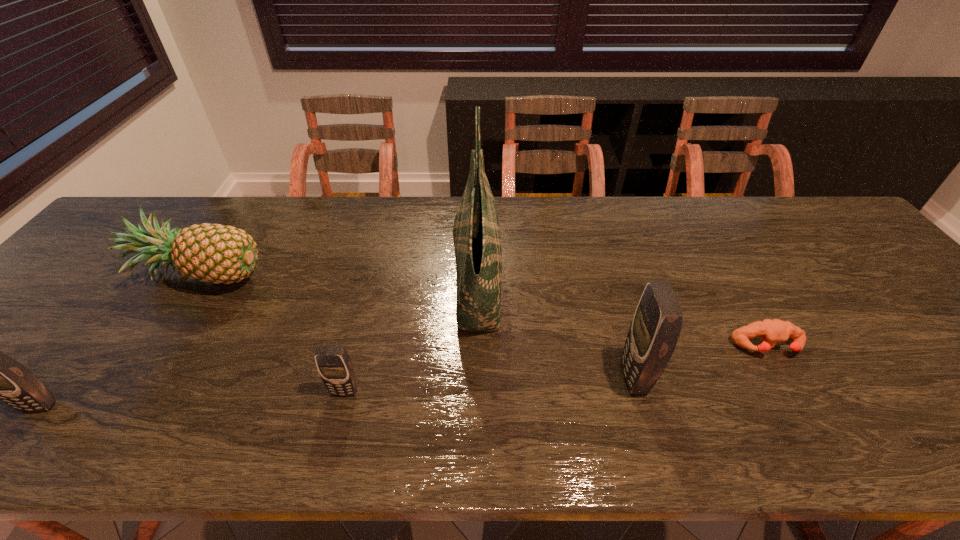
Where is `free spot at the far left corner of the desktop`? This screenshot has height=540, width=960. free spot at the far left corner of the desktop is located at coordinates (192, 196).

The width and height of the screenshot is (960, 540). I want to click on vacant space that's between the tallest object and the second shortest object, so click(411, 336).

This screenshot has width=960, height=540. I want to click on vacant region between the tallest object and the second shortest cellular telephone, so click(x=258, y=343).

Where is `empty space between the shortest object and the second cellular telephone from right to left`? This screenshot has height=540, width=960. empty space between the shortest object and the second cellular telephone from right to left is located at coordinates (556, 369).

Where is `free space that is in between the tote bag and the leftmost cellular telephone`? The image size is (960, 540). free space that is in between the tote bag and the leftmost cellular telephone is located at coordinates (258, 343).

Locate an element on the screen. The width and height of the screenshot is (960, 540). free space between the second object from right to left and the tote bag is located at coordinates (555, 329).

Identify the location of free area in between the fourth object from left to right and the leftmost cellular telephone. The width and height of the screenshot is (960, 540). (258, 343).

Locate an element on the screen. The image size is (960, 540). vacant point located between the puncher and the second tallest cellular telephone is located at coordinates (403, 376).

Where is `vacant space in between the third object from right to left and the pineapple`? vacant space in between the third object from right to left and the pineapple is located at coordinates (340, 276).

The image size is (960, 540). In order to click on blank region between the second shortest object and the puncher in this screenshot , I will do `click(556, 369)`.